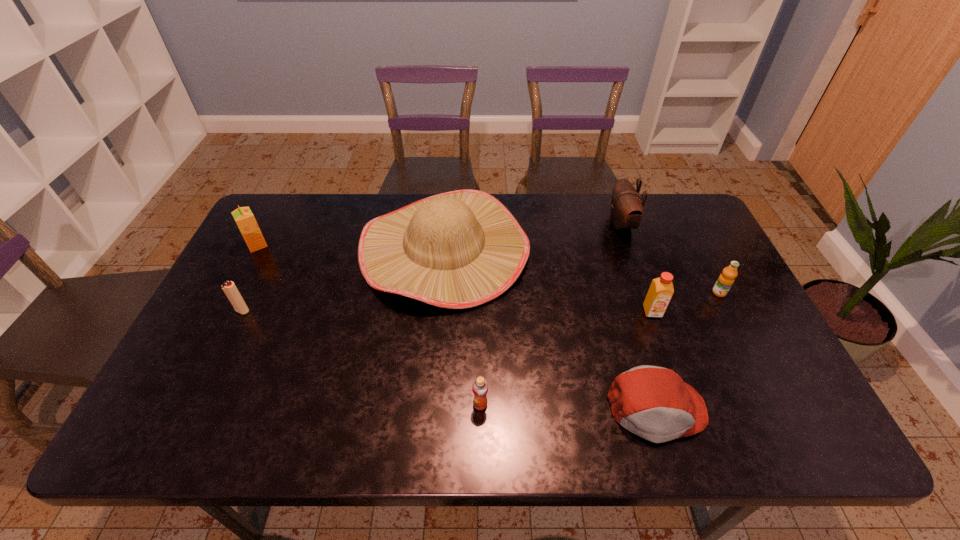
You are a GUI agent. You are given a task and a screenshot of the screen. Output one action in this format:
    pyautogui.click(x=<x>, y=<y>)
    Task: Click on the vacant space at the right edge of the desktop
    This screenshot has width=960, height=540.
    Given the screenshot: What is the action you would take?
    pyautogui.click(x=707, y=348)

In the image, there is a desktop. At what (x,y) coordinates should I click in order to perform the action: click on vacant space at the near right corner. Please return your answer as a coordinate pair (x, y). The width and height of the screenshot is (960, 540). Looking at the image, I should click on (747, 411).

I want to click on vacant space that's between the second orange juice from right to left and the cap, so click(x=655, y=361).

What are the coordinates of `unoccupied area between the sunhat and the leftmost orange juice` in the screenshot? It's located at (x=350, y=247).

At what (x,y) coordinates should I click in order to perform the action: click on free space between the third farthest orange juice and the igniter. Please return your answer as a coordinate pair (x, y). The height and width of the screenshot is (540, 960). Looking at the image, I should click on (447, 311).

Identify the location of free space between the sunhat and the pouch. This screenshot has height=540, width=960. (533, 237).

Locate an element on the screen. free space between the sunhat and the second orange juice from right to left is located at coordinates (548, 280).

Find the location of a particular element. empty location between the sunhat and the rightmost object is located at coordinates (582, 271).

Where is `free space that is in between the leftmost orange juice and the sunhat`? This screenshot has width=960, height=540. free space that is in between the leftmost orange juice and the sunhat is located at coordinates (350, 247).

Image resolution: width=960 pixels, height=540 pixels. I want to click on free point between the farthest orange juice and the cap, so click(x=457, y=327).